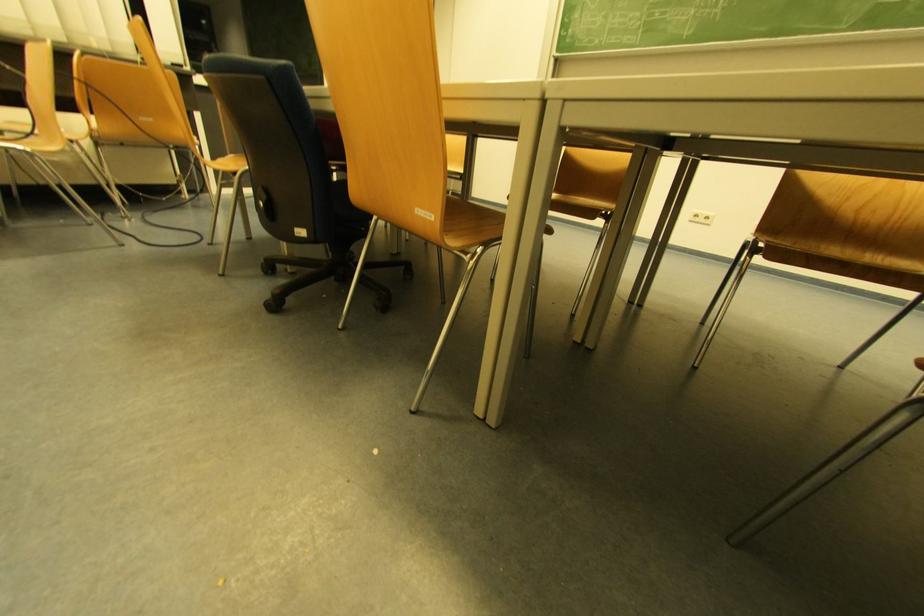
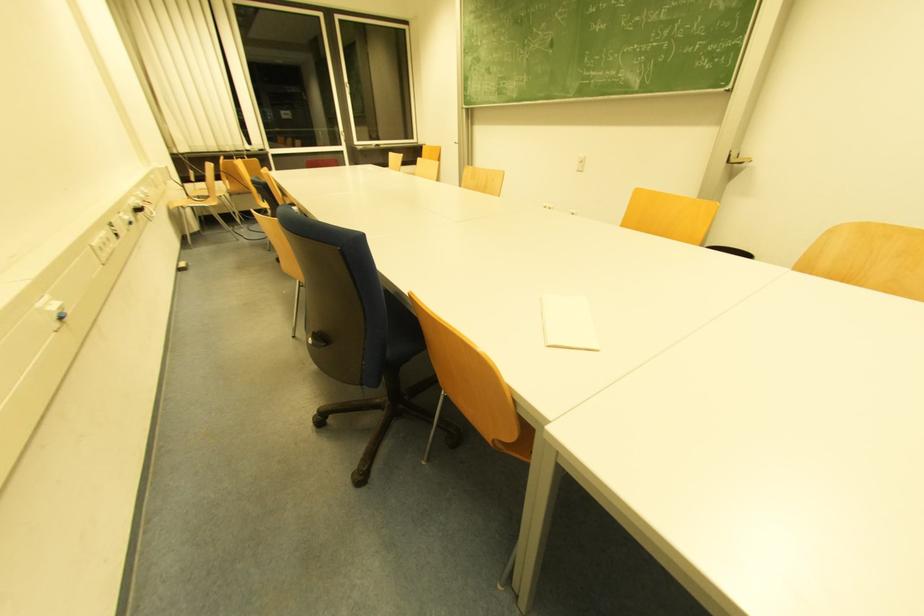
Which direction would the cameraman need to move to produce the second image?

The cameraman moved toward right, backward.